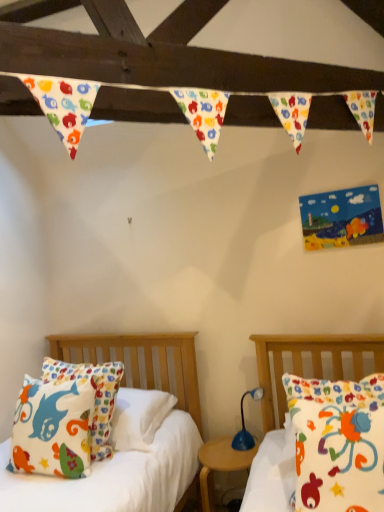
Question: Based on their sizes in the image, would you say matte cotton pillow at right, arranged as the 2th bed when viewed from the left, is bigger or smaller than wooden nightstand at center?

Choices:
 (A) big
 (B) small

Answer: (A)

Question: Is point (264, 415) closer or farther from the camera than point (201, 508)?

Choices:
 (A) closer
 (B) farther

Answer: (B)

Question: Which object is the farthest from the blue plastic lamp at center?

Choices:
 (A) matte cotton pillow at right, the first bed in the front-to-back sequence
 (B) wooden nightstand at center
 (C) matte cotton pillow at left, acting as the first bed starting from the back
 (D) matte cotton pillow at left

Answer: (D)

Question: Which object is positioned closest to the matte cotton pillow at left?

Choices:
 (A) matte cotton pillow at right, placed as the 1th bed when sorted from right to left
 (B) blue plastic lamp at center
 (C) matte cotton pillow at left, which ranks as the 2th bed in right-to-left order
 (D) wooden nightstand at center

Answer: (C)